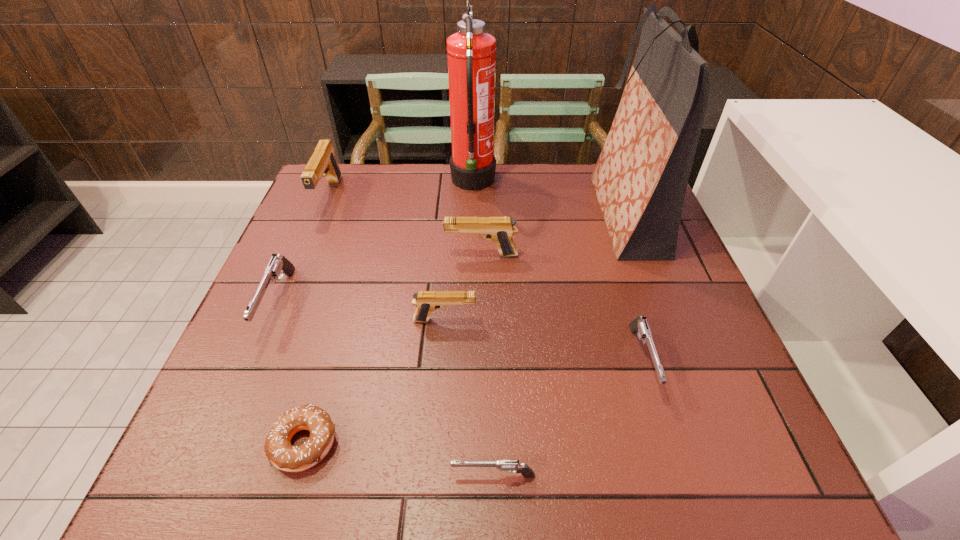
Where is `blank area in the image that satisfies the following two spatial constraints: 1. on the front-facing side of the shopping bag; 2. on the front-facing side of the rightmost pistol`? This screenshot has height=540, width=960. blank area in the image that satisfies the following two spatial constraints: 1. on the front-facing side of the shopping bag; 2. on the front-facing side of the rightmost pistol is located at coordinates (680, 360).